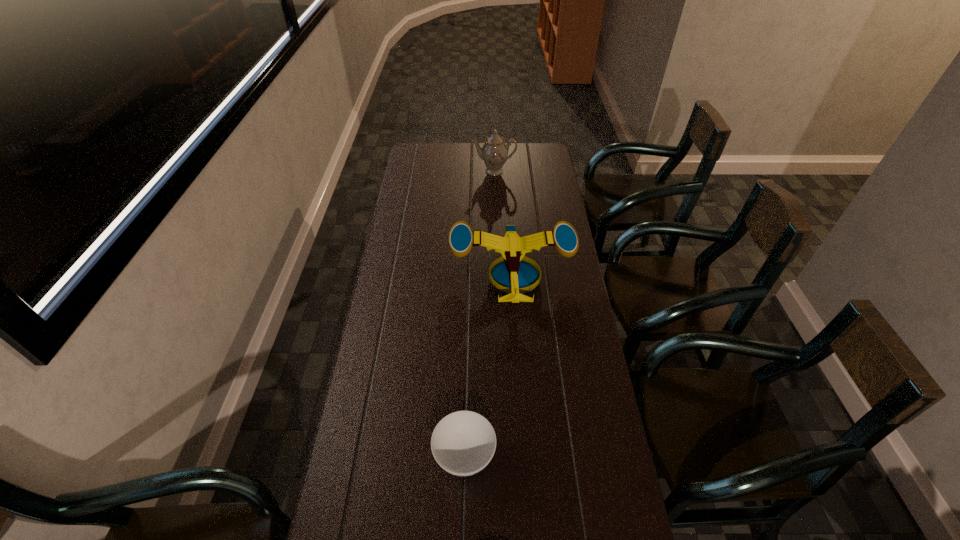
This screenshot has height=540, width=960. Identify the location of object present at the right edge. (517, 274).

Image resolution: width=960 pixels, height=540 pixels. In order to click on free space at the far edge of the desktop in this screenshot , I will do `click(474, 166)`.

You are a GUI agent. You are given a task and a screenshot of the screen. Output one action in this format:
    pyautogui.click(x=<x>, y=<y>)
    Task: Click on the blank space at the left edge of the desktop
    This screenshot has width=960, height=540.
    Given the screenshot: What is the action you would take?
    pyautogui.click(x=361, y=386)

Find the location of a particular element. The height and width of the screenshot is (540, 960). free space at the right edge of the desktop is located at coordinates (582, 534).

At what (x,y) coordinates should I click in order to perform the action: click on blank space at the far left corner of the desktop. Please return your answer as a coordinate pair (x, y). Image resolution: width=960 pixels, height=540 pixels. Looking at the image, I should click on (432, 159).

At what (x,y) coordinates should I click in order to perform the action: click on free region at the far right corner of the desktop. Please return your answer as a coordinate pair (x, y). The image size is (960, 540). Looking at the image, I should click on (545, 166).

At what (x,y) coordinates should I click in order to perform the action: click on free spot between the nearest object and the drone. Please return your answer as a coordinate pair (x, y). Image resolution: width=960 pixels, height=540 pixels. Looking at the image, I should click on (489, 364).

You are a GUI agent. You are given a task and a screenshot of the screen. Output one action in this format:
    pyautogui.click(x=<x>, y=<y>)
    Task: Click on the blank region between the shorter chinaware and the drone
    The image size is (960, 540).
    Given the screenshot: What is the action you would take?
    pyautogui.click(x=489, y=364)

Find the location of a particular element. The width and height of the screenshot is (960, 540). vacant space that's between the tallest object and the drone is located at coordinates click(x=503, y=222).

This screenshot has width=960, height=540. I want to click on vacant area between the shorter chinaware and the second nearest object, so [x=489, y=364].